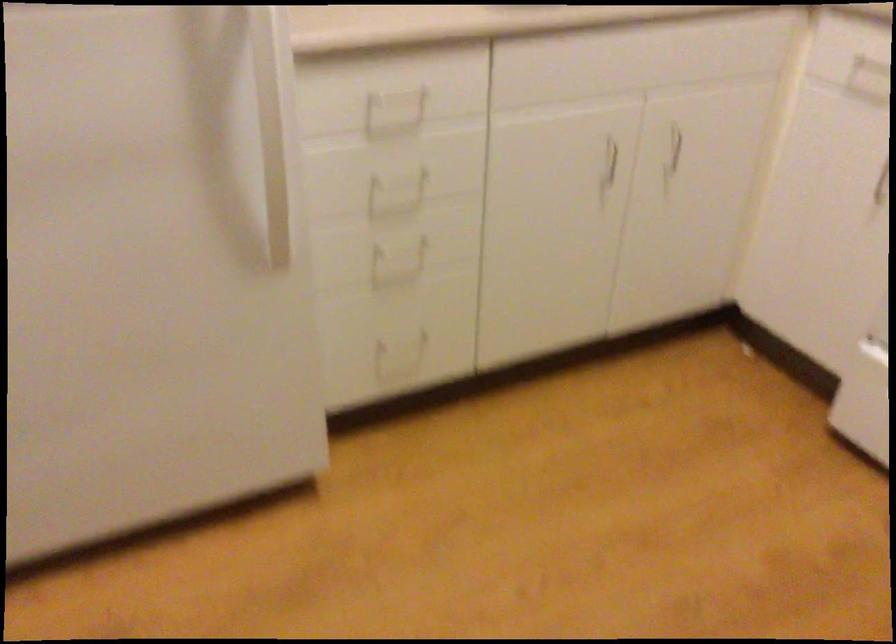
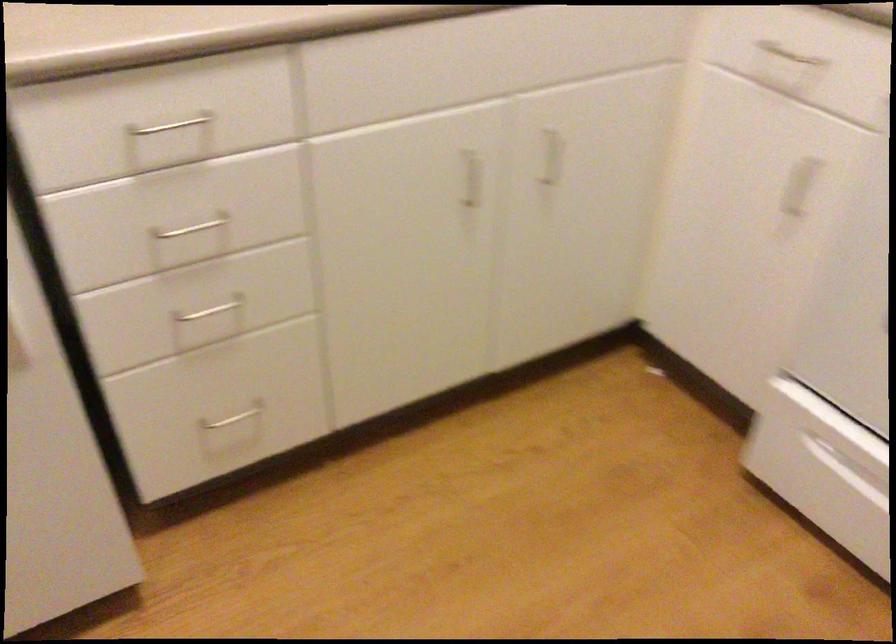
Locate, in the second image, the point that corresponds to point 395,348 in the first image.

(231, 419)